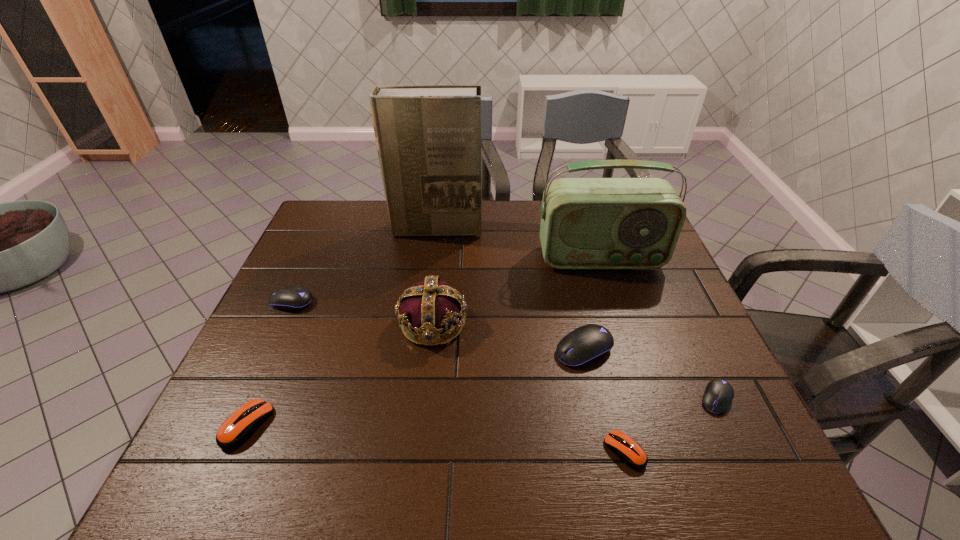
What are the coordinates of `vacant area between the smallest black computer mouse and the farthest object` in the screenshot? It's located at (576, 314).

This screenshot has height=540, width=960. Find the location of `free area in between the second farthest object and the farthest computer mouse`. free area in between the second farthest object and the farthest computer mouse is located at coordinates (446, 280).

Identify which object is the fifth nearest to the rightmost computer mouse. Please provide its 2D coordinates. Your answer should be formatted as a tuple, i.e. [(x, y)], where the tuple contains the x and y coordinates of a point satisfying the conditions above.

[(428, 137)]

Select which object appears as the fifth closest to the seventh shortest object. Please provide its 2D coordinates. Your answer should be formatted as a tuple, i.e. [(x, y)], where the tuple contains the x and y coordinates of a point satisfying the conditions above.

[(630, 452)]

Choose which computer mouse is the second nearest neighbor to the third tallest object. Please provide its 2D coordinates. Your answer should be formatted as a tuple, i.e. [(x, y)], where the tuple contains the x and y coordinates of a point satisfying the conditions above.

[(291, 298)]

Choose which computer mouse is the second nearest neighbor to the farthest object. Please provide its 2D coordinates. Your answer should be formatted as a tuple, i.e. [(x, y)], where the tuple contains the x and y coordinates of a point satisfying the conditions above.

[(587, 344)]

Identify the location of black computer mouse that is the second closest one to the farthest object. (587, 344).

Identify which black computer mouse is located as the second nearest to the purple crown. Please provide its 2D coordinates. Your answer should be formatted as a tuple, i.e. [(x, y)], where the tuple contains the x and y coordinates of a point satisfying the conditions above.

[(291, 298)]

I want to click on blank area in the image that satisfies the following two spatial constraints: 1. on the back side of the left orange computer mouse; 2. on the right side of the smallest black computer mouse, so click(259, 399).

At what (x,y) coordinates should I click in order to perform the action: click on vacant space that satisfies the following two spatial constraints: 1. on the front panel of the radio receiver; 2. on the right side of the nearest black computer mouse. Please return your answer as a coordinate pair (x, y). This screenshot has width=960, height=540. Looking at the image, I should click on (646, 399).